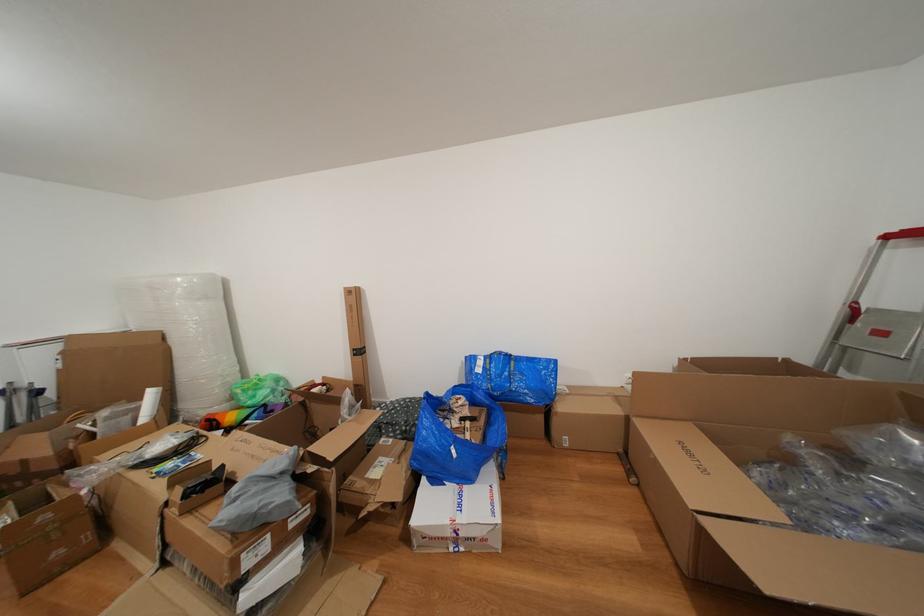
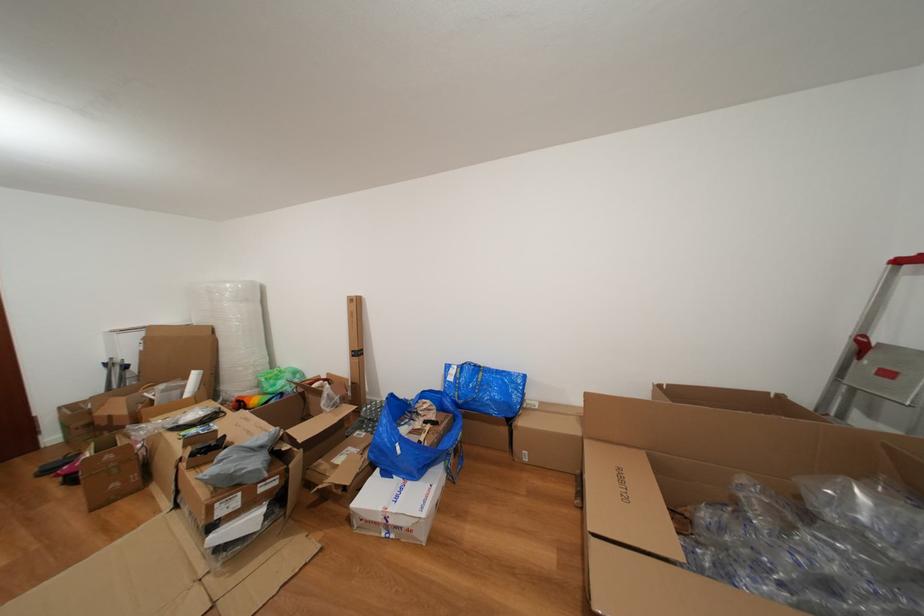
Where in the second image is the point corresponding to (262,402) from the first image?

(283, 390)